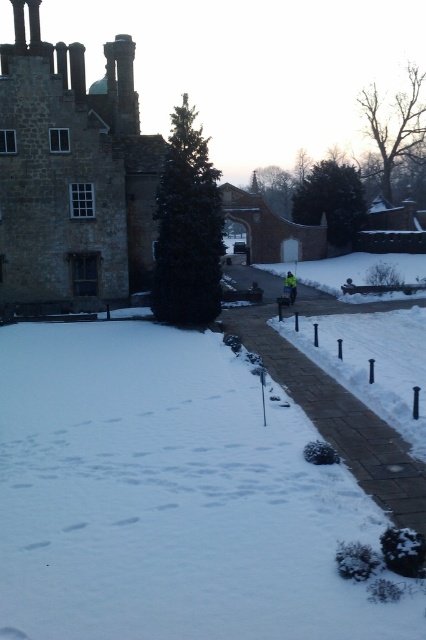
Can you confirm if brick paved path at center is positioned above yellow reflective jacket at center?

No, brick paved path at center is not above yellow reflective jacket at center.

Who is more forward, (x=405, y=465) or (x=291, y=282)?

Point (x=405, y=465) is more forward.

In order to click on brick paved path at center in this screenshot , I will do `click(339, 419)`.